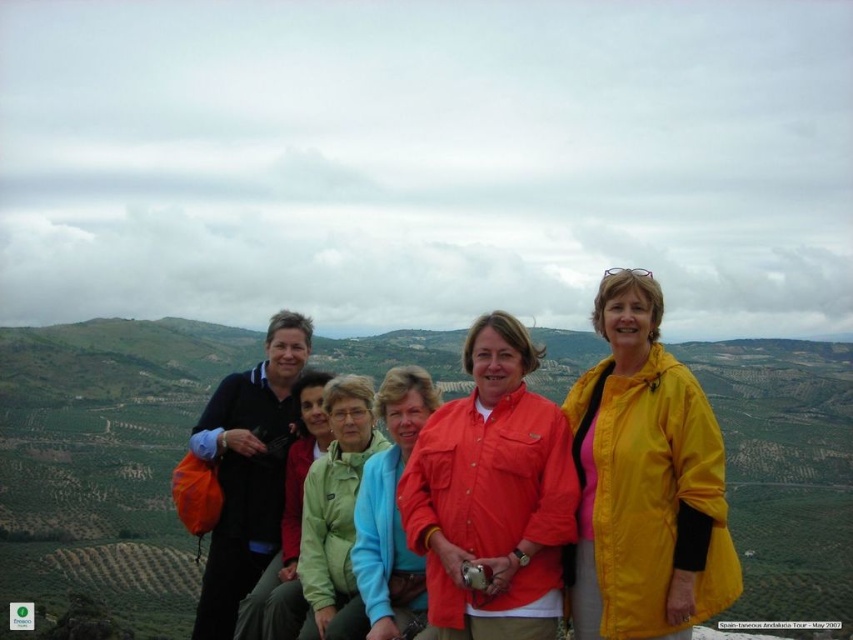
Question: Which point appears closest to the camera in this image?

Choices:
 (A) 387,572
 (B) 691,486
 (C) 680,548

Answer: (C)

Question: Does matte black jacket at center appear under matte green jacket at center?

Choices:
 (A) no
 (B) yes

Answer: (A)

Question: Which point appears farthest from the camera in this image?

Choices:
 (A) (575, 406)
 (B) (352, 419)
 (C) (491, 330)

Answer: (B)

Question: Is yellow matte jacket at right below matte orange shirt at center?

Choices:
 (A) yes
 (B) no

Answer: (B)

Question: Based on their relative distances, which object is nearer to the green fleece jacket at center?

Choices:
 (A) matte black jacket at center
 (B) matte green jacket at center
 (C) matte orange shirt at center
 (D) yellow matte jacket at right

Answer: (B)

Question: Does yellow matte jacket at right appear on the left side of green fleece jacket at center?

Choices:
 (A) yes
 (B) no

Answer: (B)